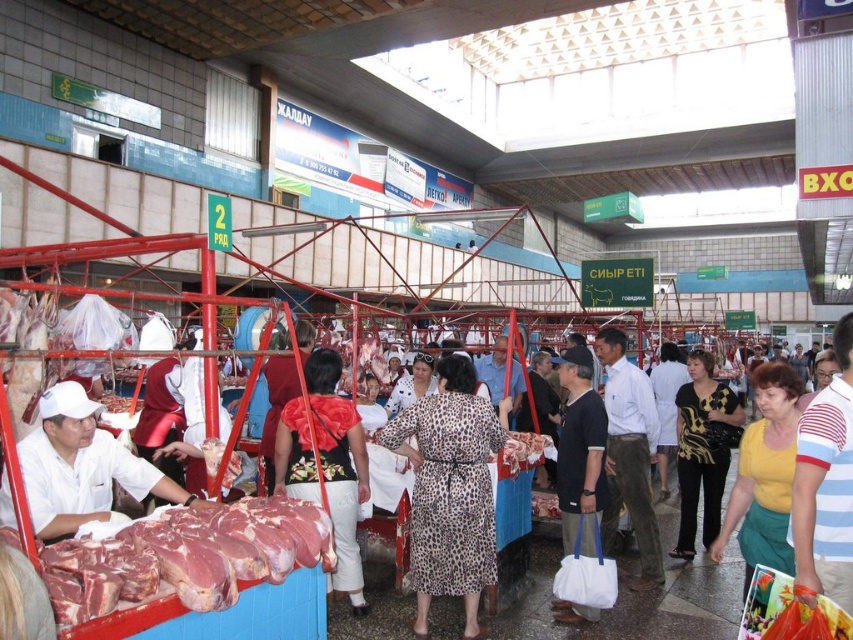
Question: In this image, where is leopard print dress at center located relative to yellow cotton shirt at center?

Choices:
 (A) above
 (B) below

Answer: (A)

Question: Which object appears closest to the camera in this image?

Choices:
 (A) leopard print dress at center
 (B) dark blue cotton shirt at center
 (C) raw meat at center

Answer: (A)

Question: Estimate the real-world distances between objects in this image. Which object is farther from the white cloth at center?

Choices:
 (A) yellow cotton shirt at center
 (B) raw meat at center

Answer: (B)

Question: Which of the following is the farthest from the observer?

Choices:
 (A) (717, 465)
 (B) (321, 364)

Answer: (A)

Question: Is floral dress at center further to camera compared to yellow cotton shirt at center?

Choices:
 (A) no
 (B) yes

Answer: (B)

Question: Does white cloth at center have a larger size compared to green leafy salad at center?

Choices:
 (A) no
 (B) yes

Answer: (B)